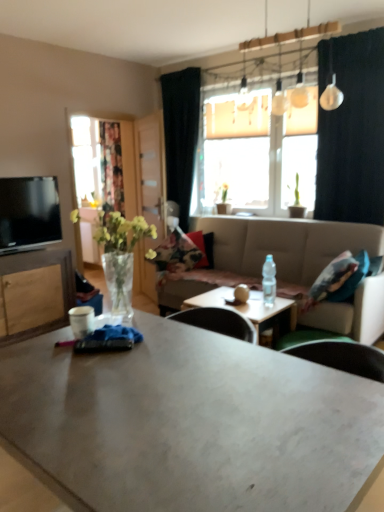
Image resolution: width=384 pixels, height=512 pixels. Find the location of `vacant space behind clear plastic bottle at center`. vacant space behind clear plastic bottle at center is located at coordinates (268, 297).